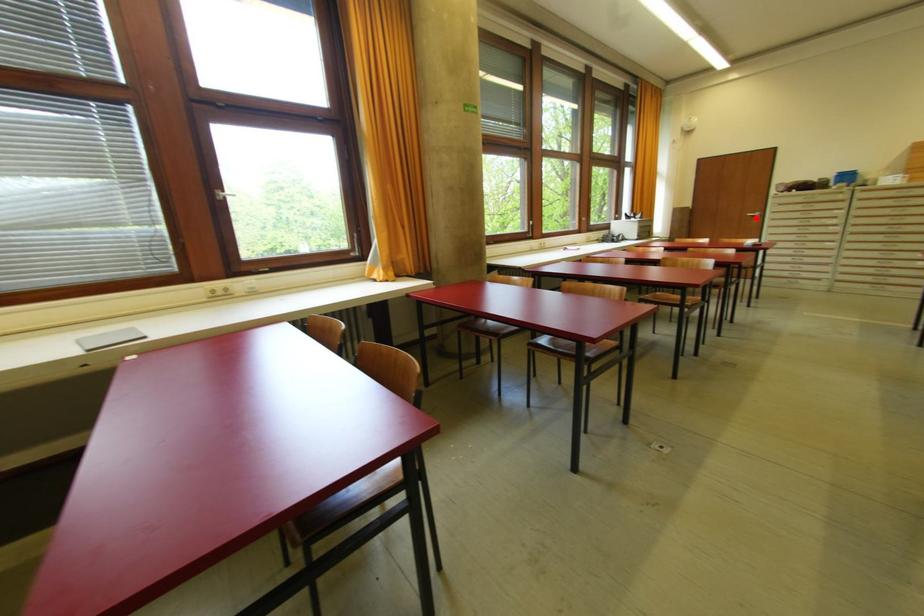
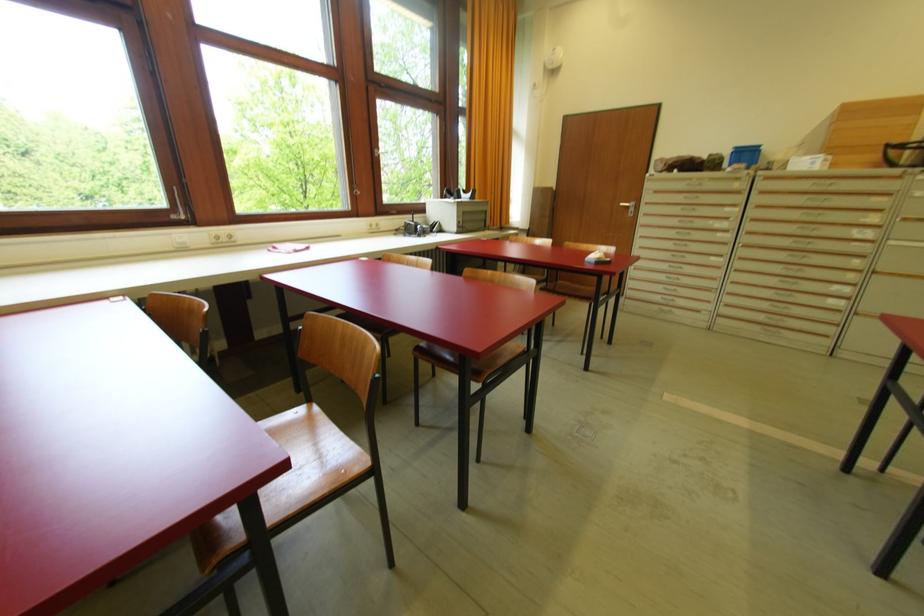
Question: I am providing you with two images of the same scene from different viewpoints. A red point is marked on the first image. Is the red point's position out of view in image 2?

Choices:
 (A) Yes
 (B) No

Answer: (B)